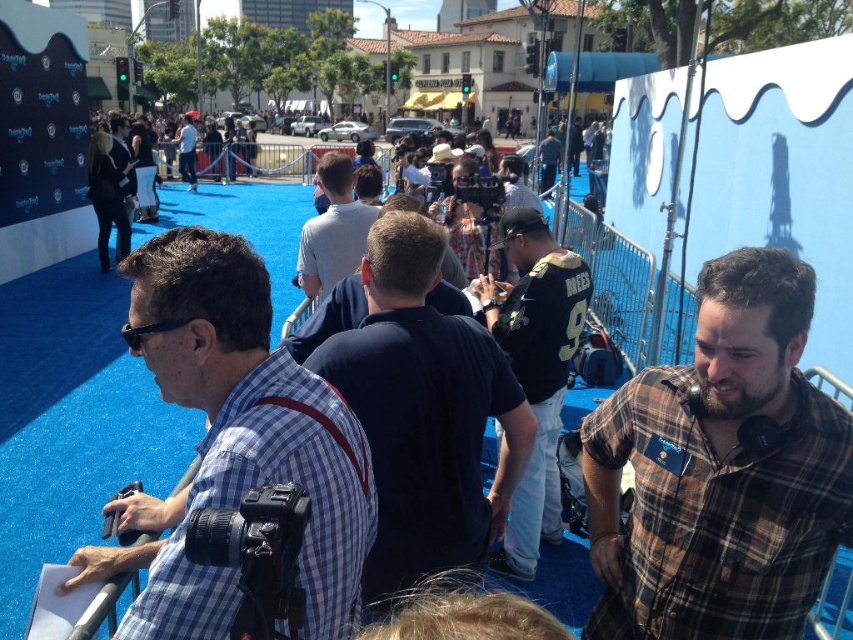
Is blue plaid shirt at center further to the viewer compared to dark blue polo shirt at center?

No.

Between blue plaid shirt at center and dark blue polo shirt at center, which one has less height?

blue plaid shirt at center

This screenshot has height=640, width=853. I want to click on blue plaid shirt at center, so click(x=234, y=442).

Which of these two, brown plaid shirt at center or light blue shirt at center, stands taller?

With more height is light blue shirt at center.

Who is more forward, (737, 346) or (195, 188)?

Point (737, 346)

This screenshot has width=853, height=640. I want to click on brown plaid shirt at center, so click(x=721, y=470).

I want to click on brown plaid shirt at center, so click(x=721, y=470).

Between dark blue polo shirt at center and light blue shirt at center, which one is positioned higher?

Positioned higher is light blue shirt at center.

The image size is (853, 640). Describe the element at coordinates (424, 412) in the screenshot. I see `dark blue polo shirt at center` at that location.

Is point (384, 406) in front of point (193, 154)?

Yes, point (384, 406) is closer to viewer.

Locate an element on the screen. Image resolution: width=853 pixels, height=640 pixels. dark blue polo shirt at center is located at coordinates (424, 412).